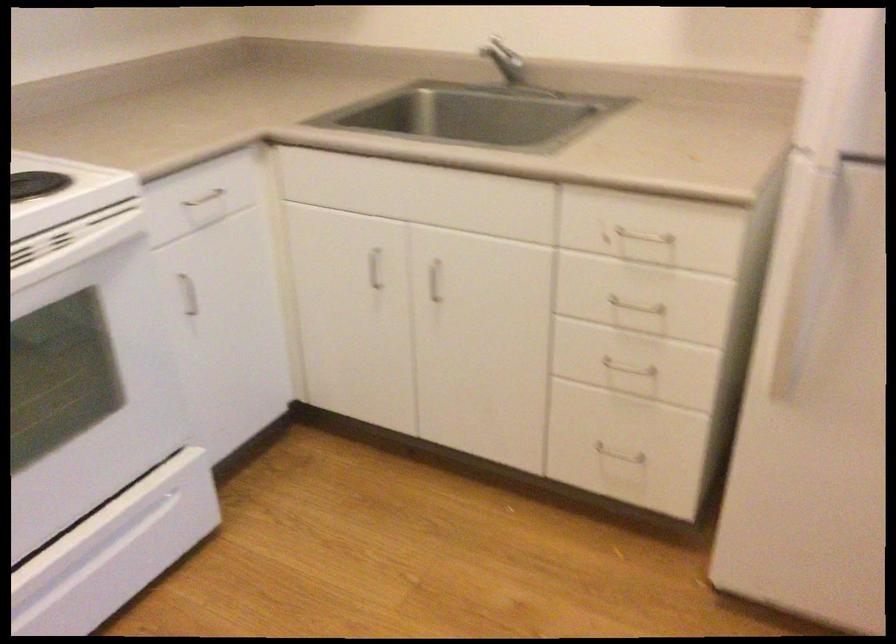
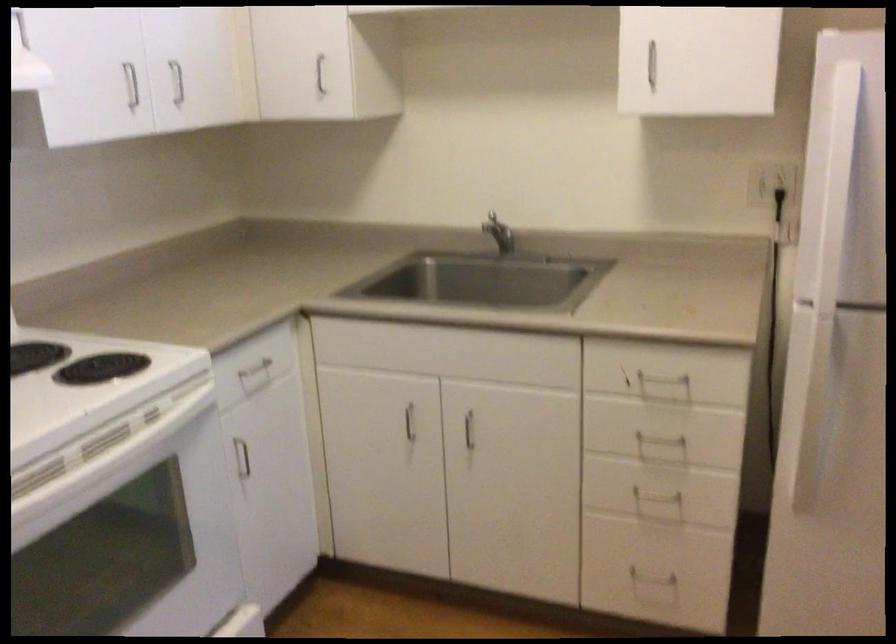
In the second image, find the point that corresponds to point 375,267 in the first image.

(409, 422)